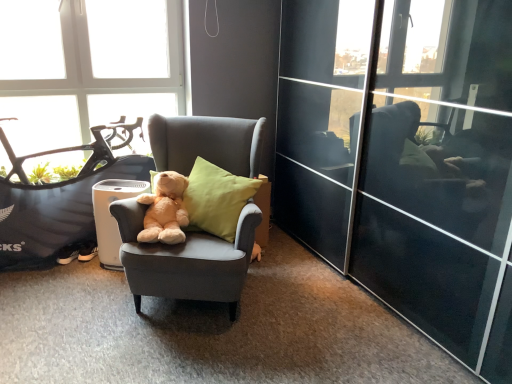
Find the location of a particular element. This screenshot has height=384, width=512. black matte mountain bike at left is located at coordinates (60, 202).

Find the location of `soft plush teddy bear at center`. soft plush teddy bear at center is located at coordinates coord(165,210).

At what (x,y) coordinates should I click in order to perform the action: click on soft yellow cushion at center. Please return your answer as a coordinate pair (x, y). Looking at the image, I should click on (216, 199).

The image size is (512, 384). What do you see at coordinates (186, 260) in the screenshot? I see `matte gray armchair at center` at bounding box center [186, 260].

Describe the element at coordinates (406, 161) in the screenshot. I see `transparent glass screen door at center` at that location.

Where is `black matte mountain bike at left`? The width and height of the screenshot is (512, 384). black matte mountain bike at left is located at coordinates (60, 202).

Does point (256, 164) come farther from viewer compared to point (157, 213)?

Yes, it is behind point (157, 213).

Which is behind, matte gray armchair at center or soft plush teddy bear at center?

soft plush teddy bear at center is behind.

Considering the positions of objects matte gray armchair at center and soft plush teddy bear at center in the image provided, who is more to the left, matte gray armchair at center or soft plush teddy bear at center?

From the viewer's perspective, soft plush teddy bear at center appears more on the left side.

Is matte gray armchair at center not close to soft plush teddy bear at center?

No, matte gray armchair at center is not far from soft plush teddy bear at center.

Does point (194, 227) lie in front of point (144, 200)?

No, it is behind (144, 200).

Does soft yellow cushion at center have a larger size compared to soft plush teddy bear at center?

Yes, soft yellow cushion at center is bigger than soft plush teddy bear at center.

Based on their positions, is soft yellow cushion at center located to the left or right of soft plush teddy bear at center?

Clearly, soft yellow cushion at center is on the right of soft plush teddy bear at center in the image.

Which object is thinner, black matte mountain bike at left or transparent glass window at upper left?

transparent glass window at upper left is thinner.

How distant is black matte mountain bike at left from transparent glass window at upper left?

A distance of 18.19 inches exists between black matte mountain bike at left and transparent glass window at upper left.

The height and width of the screenshot is (384, 512). I want to click on window that is on the left side of black matte mountain bike at left, so click(86, 67).

Based on their sizes in the image, would you say black matte mountain bike at left is bigger or smaller than transparent glass window at upper left?

black matte mountain bike at left is bigger than transparent glass window at upper left.

Does black matte mountain bike at left turn towards soft plush teddy bear at center?

Yes, black matte mountain bike at left is aimed at soft plush teddy bear at center.

This screenshot has height=384, width=512. In order to click on mountain bike that is under the soft plush teddy bear at center (from a real-world perspective) in this screenshot , I will do `click(60, 202)`.

Is black matte mountain bike at left with soft plush teddy bear at center?

black matte mountain bike at left and soft plush teddy bear at center are not in contact.

Is point (113, 161) more distant than point (157, 233)?

Yes, it is behind point (157, 233).

Is black matte mountain bike at left next to transparent glass screen door at center and touching it?

No, black matte mountain bike at left is not next to transparent glass screen door at center.

Is black matte mountain bike at left inside or outside of transparent glass screen door at center?

black matte mountain bike at left cannot be found inside transparent glass screen door at center.

From a real-world perspective, between black matte mountain bike at left and transparent glass screen door at center, who is vertically lower?

black matte mountain bike at left.

Considering the relative positions of transparent glass window at upper left and soft yellow cushion at center in the image provided, is transparent glass window at upper left to the right of soft yellow cushion at center from the viewer's perspective?

No.

From the image's perspective, which one is positioned higher, transparent glass window at upper left or soft yellow cushion at center?

transparent glass window at upper left appears higher in the image.

Is transparent glass window at upper left inside or outside of soft yellow cushion at center?

transparent glass window at upper left is not enclosed by soft yellow cushion at center.

Would you say transparent glass window at upper left is a long distance from black matte mountain bike at left?

That's not correct — transparent glass window at upper left is a little close to black matte mountain bike at left.

Can you confirm if transparent glass window at upper left is thinner than black matte mountain bike at left?

Indeed, transparent glass window at upper left has a lesser width compared to black matte mountain bike at left.

Between point (94, 35) and point (93, 142), which one is positioned in front?

Positioned in front is point (94, 35).

From the image's perspective, is transparent glass window at upper left located above or below black matte mountain bike at left?

From the image's perspective, transparent glass window at upper left appears above black matte mountain bike at left.

At what (x,y) coordinates should I click in order to perform the action: click on chair in front of the soft plush teddy bear at center. Please return your answer as a coordinate pair (x, y). Image resolution: width=512 pixels, height=384 pixels. Looking at the image, I should click on (186, 260).

Locate an element on the screen. This screenshot has width=512, height=384. pillow lying on the right of soft plush teddy bear at center is located at coordinates (216, 199).

When comparing their distances from black matte mountain bike at left, does soft plush teddy bear at center or matte gray armchair at center seem closer?

The object closer to black matte mountain bike at left is soft plush teddy bear at center.

Based on their spatial positions, is black matte mountain bike at left or transparent glass screen door at center further from matte gray armchair at center?

Among the two, transparent glass screen door at center is located further to matte gray armchair at center.

From the image, which object appears to be farther from transparent glass window at upper left, transparent glass screen door at center or soft plush teddy bear at center?

transparent glass screen door at center is positioned further to the anchor transparent glass window at upper left.

Based on their spatial positions, is transparent glass window at upper left or matte gray armchair at center closer to black matte mountain bike at left?

transparent glass window at upper left lies closer to black matte mountain bike at left than the other object.

Based on their spatial positions, is transparent glass window at upper left or soft plush teddy bear at center closer to matte gray armchair at center?

soft plush teddy bear at center.

Based on their spatial positions, is black matte mountain bike at left or transparent glass window at upper left closer to soft plush teddy bear at center?

Among the two, black matte mountain bike at left is located nearer to soft plush teddy bear at center.

Estimate the real-world distances between objects in this image. Which object is closer to soft plush teddy bear at center, black matte mountain bike at left or transparent glass screen door at center?

black matte mountain bike at left lies closer to soft plush teddy bear at center than the other object.

Estimate the real-world distances between objects in this image. Which object is closer to black matte mountain bike at left, matte gray armchair at center or transparent glass window at upper left?

transparent glass window at upper left lies closer to black matte mountain bike at left than the other object.

Locate an element on the screen. pillow located between transparent glass window at upper left and transparent glass screen door at center in the left-right direction is located at coordinates (216, 199).

Locate an element on the screen. Image resolution: width=512 pixels, height=384 pixels. mountain bike between transparent glass window at upper left and soft plush teddy bear at center in the vertical direction is located at coordinates (60, 202).

Where is `pillow between black matte mountain bike at left and transparent glass screen door at center`? pillow between black matte mountain bike at left and transparent glass screen door at center is located at coordinates (216, 199).

Find the location of a particular element. The height and width of the screenshot is (384, 512). teddy bear between transparent glass window at upper left and soft yellow cushion at center is located at coordinates (165, 210).